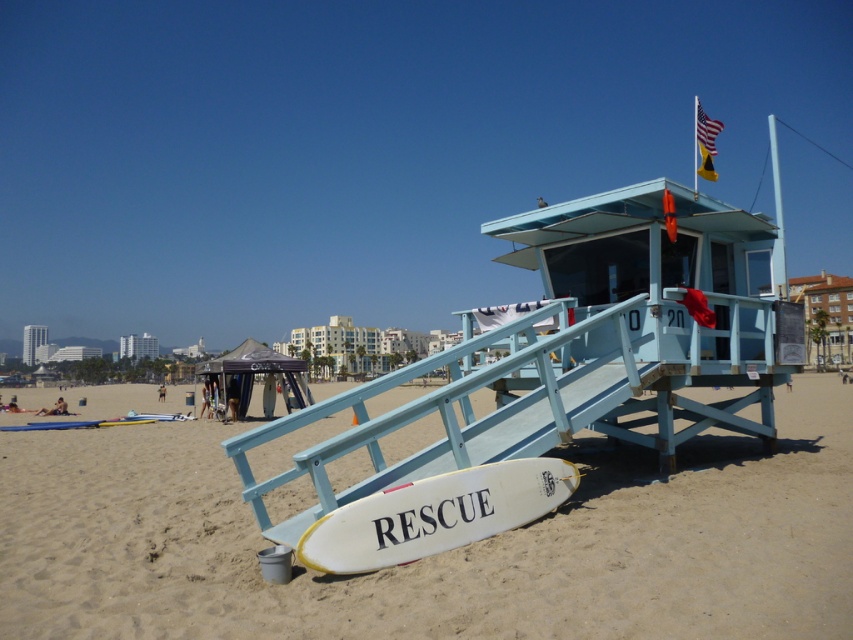
Between white sand at lower center and white matte surfboard at lower center, which one is positioned higher?

white matte surfboard at lower center

Between point (189, 424) and point (412, 554), which one is positioned behind?

The point (189, 424) is more distant.

You are a GUI agent. You are given a task and a screenshot of the screen. Output one action in this format:
    pyautogui.click(x=<x>, y=<y>)
    Task: Click on the white sand at lower center
    
    Given the screenshot: What is the action you would take?
    pyautogui.click(x=440, y=554)

Which is below, white matte surfboard at lower center or purple fabric canopy at lower left?

Positioned lower is purple fabric canopy at lower left.

Who is more forward, [527,499] or [276,356]?

Positioned in front is point [527,499].

Where is `white matte surfboard at lower center`? The width and height of the screenshot is (853, 640). white matte surfboard at lower center is located at coordinates (434, 515).

Which is more to the left, white sand at lower center or purple fabric canopy at lower left?

purple fabric canopy at lower left

Is white sand at lower center behind purple fabric canopy at lower left?

No, it is not.

Is point (71, 433) in front of point (216, 378)?

Yes.

The width and height of the screenshot is (853, 640). Identify the location of white sand at lower center. (440, 554).